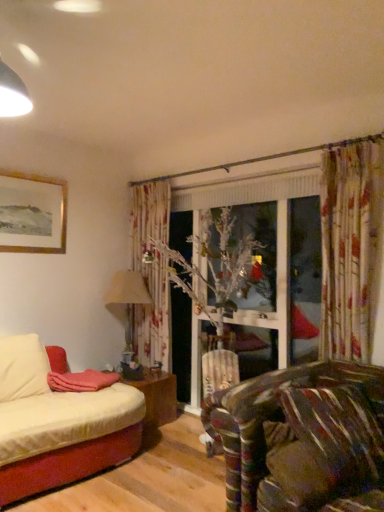
Question: Considering the relative positions of brown textured pillow at lower right, which appears as the second pillow when viewed from the right, and velvet brown pillow at lower right, marked as the first pillow in a right-to-left arrangement, in the image provided, is brown textured pillow at lower right, which appears as the second pillow when viewed from the right, to the right of velvet brown pillow at lower right, marked as the first pillow in a right-to-left arrangement, from the viewer's perspective?

Choices:
 (A) yes
 (B) no

Answer: (B)

Question: Is brown textured pillow at lower right, acting as the first pillow starting from the left, oriented away from velvet brown pillow at lower right, the 2th pillow positioned from the left?

Choices:
 (A) no
 (B) yes

Answer: (B)

Question: Is brown textured pillow at lower right, which appears as the second pillow when viewed from the right, touching velvet brown pillow at lower right, the 2th pillow positioned from the left?

Choices:
 (A) no
 (B) yes

Answer: (A)

Question: From the image's perspective, does brown textured pillow at lower right, acting as the first pillow starting from the left, appear higher than velvet brown pillow at lower right, marked as the first pillow in a right-to-left arrangement?

Choices:
 (A) yes
 (B) no

Answer: (B)

Question: From the image's perspective, is brown textured pillow at lower right, acting as the first pillow starting from the left, located beneath velvet brown pillow at lower right, marked as the first pillow in a right-to-left arrangement?

Choices:
 (A) no
 (B) yes

Answer: (B)

Question: Based on their sizes in the image, would you say beige fabric lampshade at center is bigger or smaller than velvet brown pillow at lower right, the 2th pillow positioned from the left?

Choices:
 (A) small
 (B) big

Answer: (B)

Question: Is beige fabric lampshade at center wider or thinner than velvet brown pillow at lower right, the 2th pillow positioned from the left?

Choices:
 (A) wide
 (B) thin

Answer: (A)

Question: Is beige fabric lampshade at center situated inside velvet brown pillow at lower right, the 2th pillow positioned from the left, or outside?

Choices:
 (A) outside
 (B) inside

Answer: (A)

Question: Considering the positions of beige fabric lampshade at center and velvet brown pillow at lower right, marked as the first pillow in a right-to-left arrangement, in the image, is beige fabric lampshade at center taller or shorter than velvet brown pillow at lower right, marked as the first pillow in a right-to-left arrangement,?

Choices:
 (A) short
 (B) tall

Answer: (B)

Question: Visually, is velvet brown pillow at lower right, the 2th pillow positioned from the left, positioned to the left or to the right of gold-framed painting at upper left?

Choices:
 (A) left
 (B) right

Answer: (B)

Question: Considering the positions of velvet brown pillow at lower right, the 2th pillow positioned from the left, and gold-framed painting at upper left in the image, is velvet brown pillow at lower right, the 2th pillow positioned from the left, taller or shorter than gold-framed painting at upper left?

Choices:
 (A) short
 (B) tall

Answer: (B)

Question: From the image's perspective, relative to gold-framed painting at upper left, is velvet brown pillow at lower right, the 2th pillow positioned from the left, above or below?

Choices:
 (A) below
 (B) above

Answer: (A)

Question: Is velvet brown pillow at lower right, the 2th pillow positioned from the left, wider or thinner than gold-framed painting at upper left?

Choices:
 (A) thin
 (B) wide

Answer: (B)

Question: Relative to gold-framed painting at upper left, is wooden table at lower left in front or behind?

Choices:
 (A) behind
 (B) front

Answer: (A)

Question: From their relative heights in the image, would you say wooden table at lower left is taller or shorter than gold-framed painting at upper left?

Choices:
 (A) short
 (B) tall

Answer: (A)